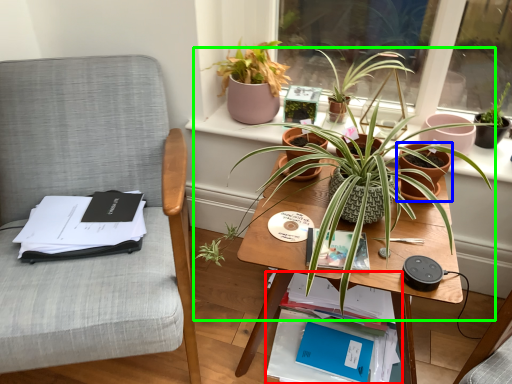
Question: Which is farther away from book (highlighted by a red box)? flowerpot (highlighted by a blue box) or houseplant (highlighted by a green box)?

Choices:
 (A) flowerpot
 (B) houseplant

Answer: (A)